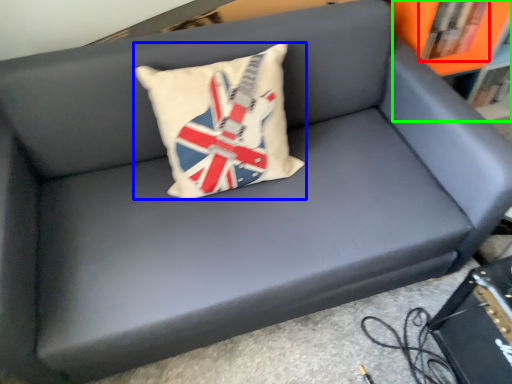
Question: Estimate the real-world distances between objects in this image. Which object is closer to book (highlighted by a red box), pillow (highlighted by a blue box) or bookcase (highlighted by a green box)?

Choices:
 (A) pillow
 (B) bookcase

Answer: (B)